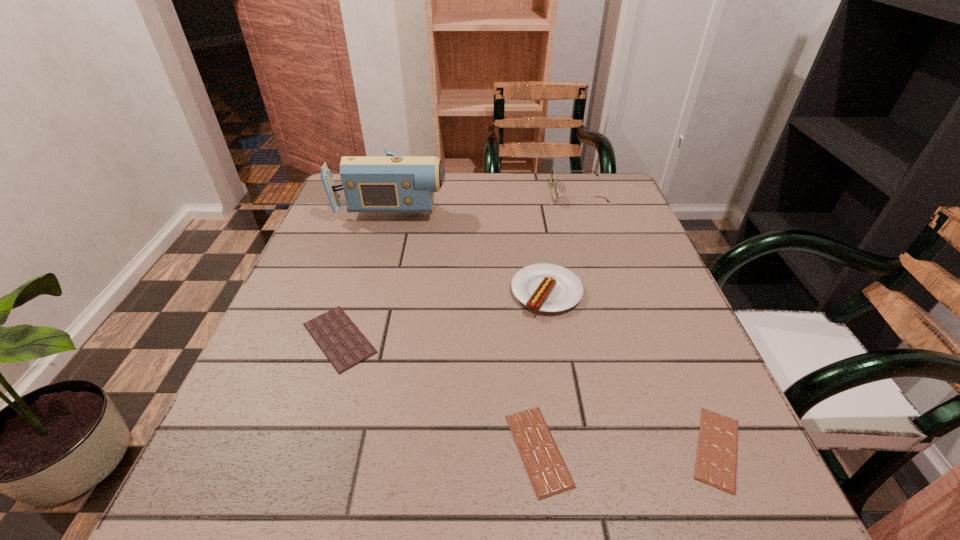
Where is `free location that satisfies the following two spatial constraints: 1. on the front-facing side of the sunglasses; 2. on the back side of the rightmost chocolate bar`? free location that satisfies the following two spatial constraints: 1. on the front-facing side of the sunglasses; 2. on the back side of the rightmost chocolate bar is located at coordinates (662, 449).